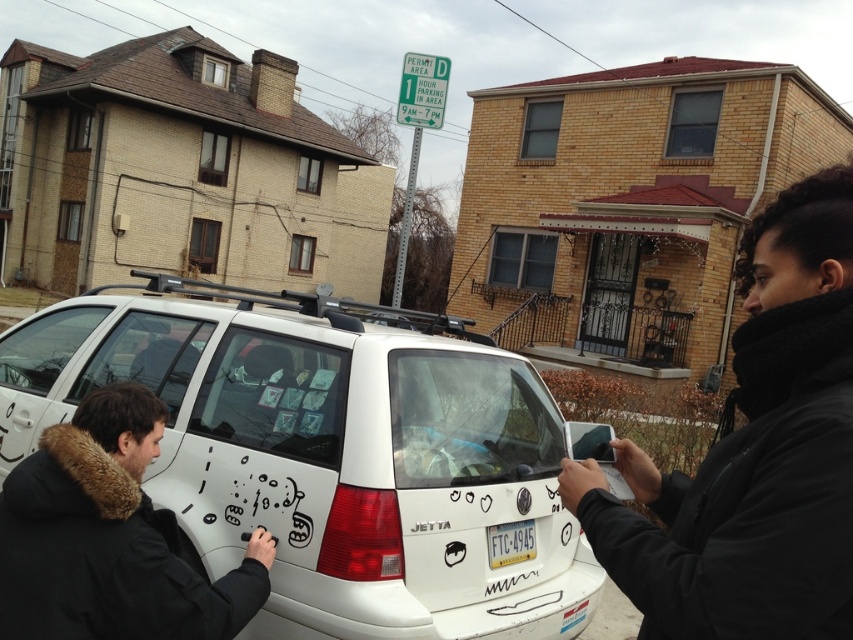
Does black fuzzy jacket at center have a lesser height compared to black fur coat at lower left?

Incorrect, black fuzzy jacket at center's height does not fall short of black fur coat at lower left's.

Is black fuzzy jacket at center to the right of black fur coat at lower left from the viewer's perspective?

Indeed, black fuzzy jacket at center is positioned on the right side of black fur coat at lower left.

Is point (741, 365) closer to viewer compared to point (126, 518)?

Yes, it is in front of point (126, 518).

Find the location of `black fuzzy jacket at center`. black fuzzy jacket at center is located at coordinates (753, 452).

I want to click on black fuzzy jacket at center, so click(x=753, y=452).

Between point (735, 516) and point (494, 557), which one is positioned behind?

Positioned behind is point (494, 557).

What are the coordinates of `black fuzzy jacket at center` in the screenshot? It's located at (753, 452).

Does white matte suv at center have a greater height compared to white plastic license plate at center?

Indeed, white matte suv at center has a greater height compared to white plastic license plate at center.

Can you confirm if white matte suv at center is bigger than white plastic license plate at center?

Indeed, white matte suv at center has a larger size compared to white plastic license plate at center.

Is point (178, 417) farther from viewer compared to point (511, 536)?

Yes, it is.

At what (x,y) coordinates should I click in order to perform the action: click on white matte suv at center. Please return your answer as a coordinate pair (x, y). Looking at the image, I should click on (328, 452).